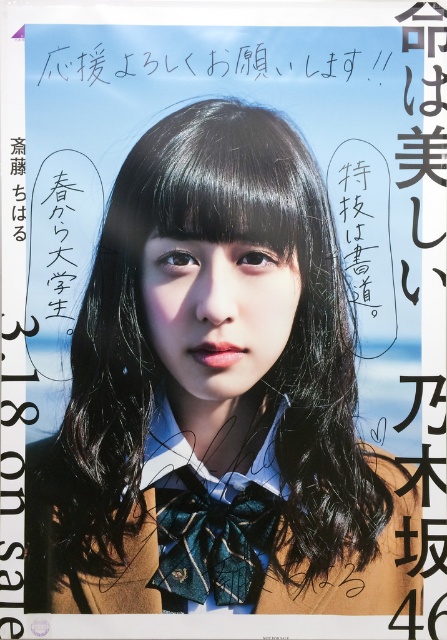
You are standing 5 feet away from the poster. The point labeled as point (253, 252) is part of the image. Can you reach this point with your hand if you extend your arm fully? Please explain your reasoning.

The point (253, 252) is 38.08 inches from the viewer. Since you are standing 5 feet away, which is 60 inches, the point is closer than your reach. If you extend your arm fully, which is typically around 28 to 32 inches, you can reach up to about 5 feet plus your arm length. However, the point is only 38.08 inches away, so you can easily reach it with your hand.

You are designing a poster and need to ensure that the matte brown school uniform at center and the matte black face at center are proportionally sized. According to the image, which object should be made larger to maintain the correct proportions?

The matte brown school uniform at center should be made larger than the matte black face at center to maintain correct proportions as it is already larger in the image.

Consider the image. You are designing a poster and need to place a new element exactly where the teal textured tie at center is located. What coordinates should you use for the center point of your new element?

The teal textured tie at center is positioned at coordinates point [213,541], so you should place your new element at those coordinates.